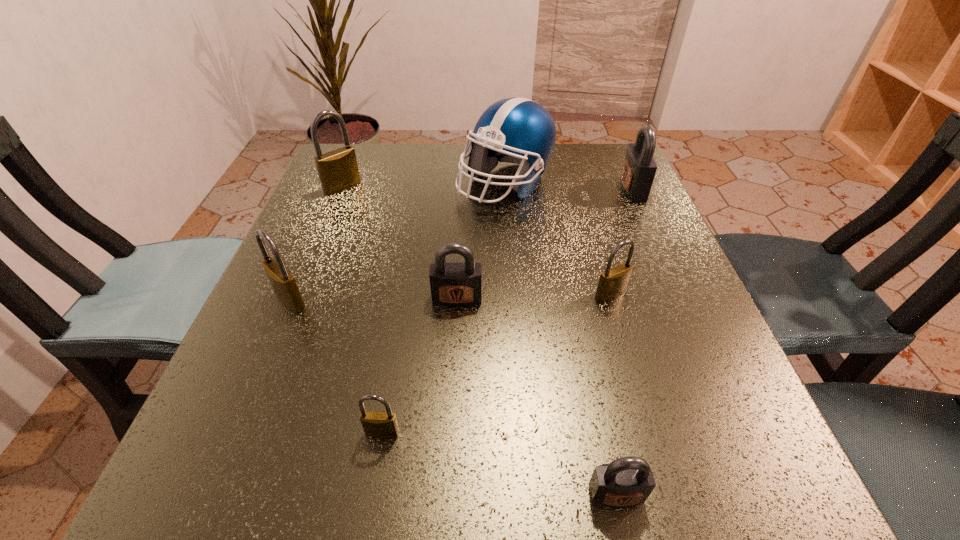
This screenshot has width=960, height=540. In order to click on the third brass padlock from left to right in this screenshot , I will do `click(379, 424)`.

Where is `the third object from left to right`? the third object from left to right is located at coordinates (379, 424).

This screenshot has height=540, width=960. In order to click on the smallest gray padlock in this screenshot , I will do `click(627, 481)`.

The image size is (960, 540). I want to click on the nearest object, so click(627, 481).

This screenshot has height=540, width=960. Identify the location of vacant area situated at the front of the football helmet with the faceguard. (511, 258).

Locate an element on the screen. The width and height of the screenshot is (960, 540). blank space located on the right of the farthest brass padlock is located at coordinates (530, 187).

You are a GUI agent. You are given a task and a screenshot of the screen. Output one action in this format:
    pyautogui.click(x=<x>, y=<y>)
    Task: Click on the vacant space situated 0.170m on the front of the biggest gray padlock near the keyhole
    
    Given the screenshot: What is the action you would take?
    pyautogui.click(x=546, y=188)

At what (x,y) coordinates should I click in order to perform the action: click on vacant space located 0.110m on the front of the biggest gray padlock near the keyhole. Please return your answer as a coordinate pair (x, y). This screenshot has width=960, height=540. Looking at the image, I should click on (572, 188).

I want to click on vacant space located on the front of the biggest gray padlock near the keyhole, so point(490,188).

You are a GUI agent. You are given a task and a screenshot of the screen. Output one action in this format:
    pyautogui.click(x=<x>, y=<y>)
    Task: Click on the vacant space located 0.280m on the back of the second biggest brass padlock
    The height and width of the screenshot is (540, 960).
    Given the screenshot: What is the action you would take?
    pyautogui.click(x=333, y=198)